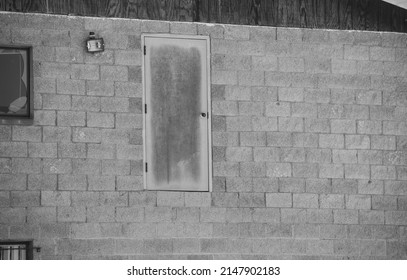
Identify the location of hinges. (144, 50), (143, 111), (146, 168).